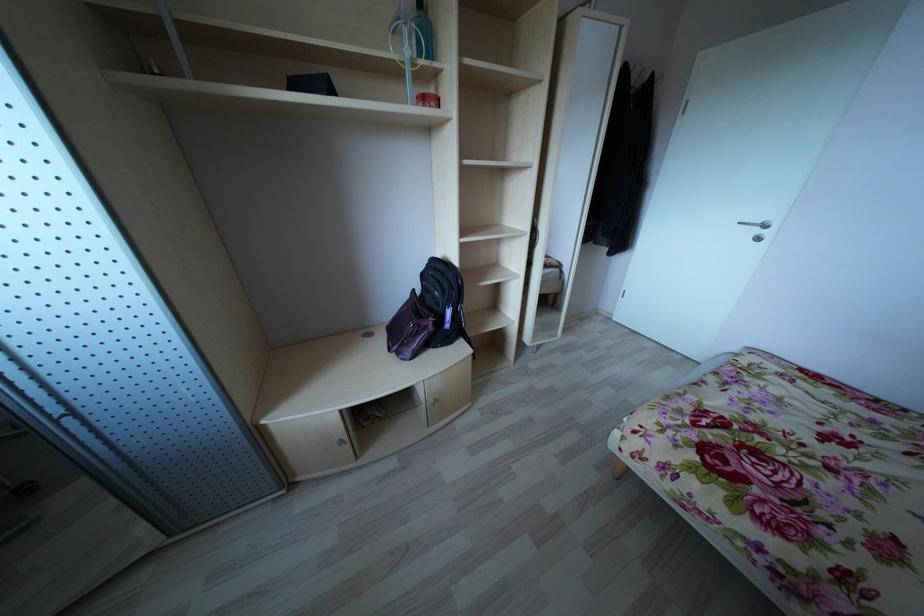
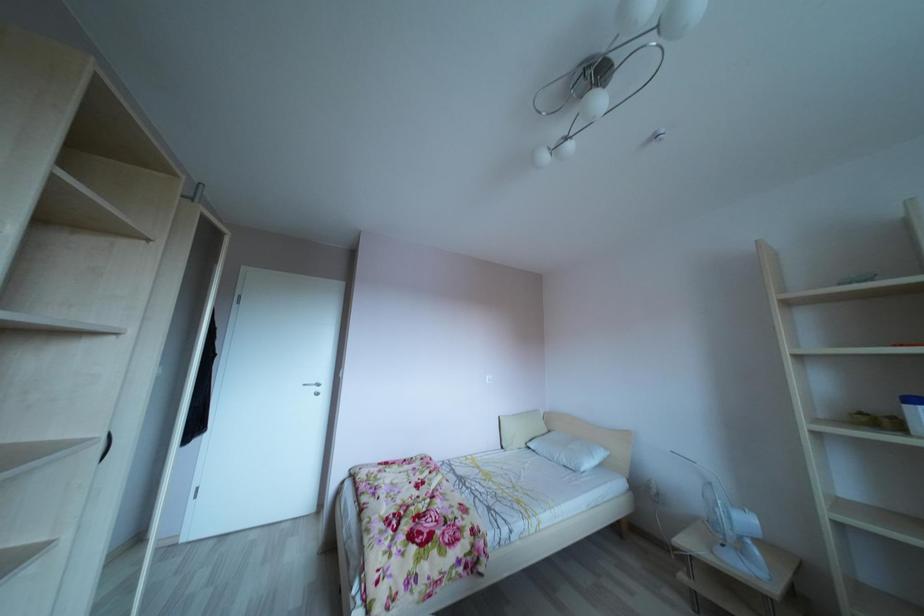
Question: The camera is either moving clockwise (left) or counter-clockwise (right) around the object. The first image is from the beginning of the video and the second image is from the end. Is the camera moving left or right when shooting the video?

Choices:
 (A) Left
 (B) Right

Answer: (A)